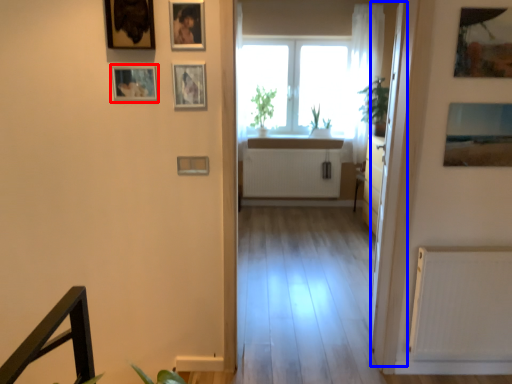
Question: Which of the following is the farthest to the observer, picture frame (highlighted by a red box) or glass door (highlighted by a blue box)?

Choices:
 (A) picture frame
 (B) glass door

Answer: (B)